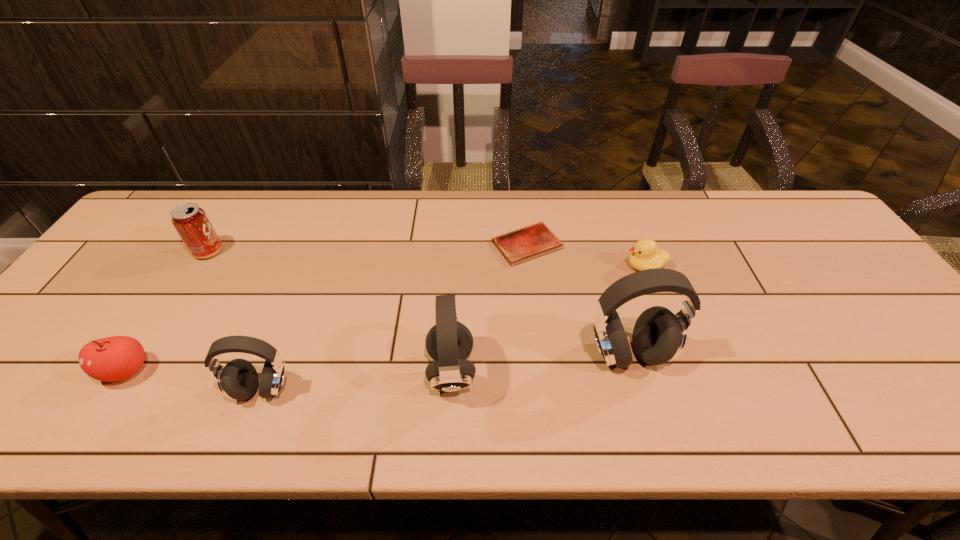
Where is `vacant space at the far edge of the desktop`? vacant space at the far edge of the desktop is located at coordinates (706, 218).

Identify the location of vacant space at the near edge of the desktop. This screenshot has height=540, width=960. (323, 368).

In the image, there is a desktop. Where is `vacant region at the left edge`? The image size is (960, 540). vacant region at the left edge is located at coordinates (127, 279).

At what (x,y) coordinates should I click in order to perform the action: click on free space at the right edge of the desktop. Please return your answer as a coordinate pair (x, y). Looking at the image, I should click on (826, 246).

The image size is (960, 540). I want to click on vacant area at the far left corner, so click(x=210, y=190).

Identify the location of vacant area at the far right corner of the desktop. click(779, 224).

The width and height of the screenshot is (960, 540). I want to click on empty space between the fourth tallest object and the shortest object, so click(368, 248).

Identify the location of free space between the fourth tallest object and the second tallest object. The height and width of the screenshot is (540, 960). (330, 311).

Where is `free space between the duckling and the third shortest object`? Image resolution: width=960 pixels, height=540 pixels. free space between the duckling and the third shortest object is located at coordinates (386, 319).

This screenshot has width=960, height=540. Find the location of `free area in between the leftmost headset and the apple`. free area in between the leftmost headset and the apple is located at coordinates pos(194,380).